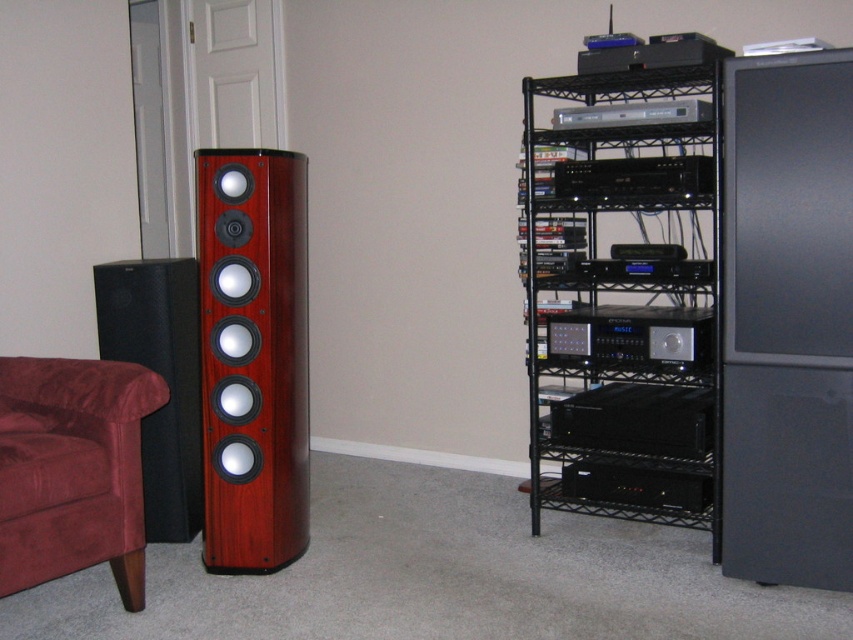
Describe the element at coordinates (163, 380) in the screenshot. I see `black matte speaker at left` at that location.

Is point (184, 394) farther from viewer compared to point (583, 477)?

No, (184, 394) is in front of (583, 477).

Between point (165, 289) and point (619, 492), which one is positioned behind?

Point (619, 492)

What are the coordinates of `black matte speaker at left` in the screenshot? It's located at pos(163,380).

Is velvet maroon armchair at lower left below satin black stereo at center?

Yes, velvet maroon armchair at lower left is below satin black stereo at center.

You are a GUI agent. You are given a task and a screenshot of the screen. Output one action in this format:
    pyautogui.click(x=<x>, y=<y>)
    Task: Click on the velvet maroon armchair at lower left
    This screenshot has width=853, height=640.
    Given the screenshot: What is the action you would take?
    pyautogui.click(x=73, y=468)

Does point (593, 412) come farther from viewer compared to point (636, 324)?

Yes, point (593, 412) is behind point (636, 324).

The height and width of the screenshot is (640, 853). What do you see at coordinates (637, 419) in the screenshot?
I see `black matte stereo at center-right` at bounding box center [637, 419].

Does point (598, 388) come farther from viewer compared to point (672, 353)?

Yes.

The image size is (853, 640). I want to click on black matte stereo at center-right, so click(637, 419).